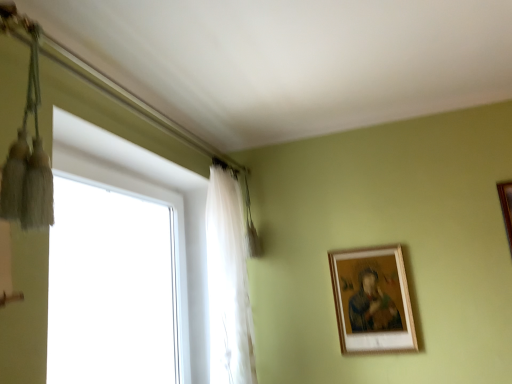
Image resolution: width=512 pixels, height=384 pixels. Describe the element at coordinates (156, 200) in the screenshot. I see `white glass window at left` at that location.

Where is `translucent white curtain at upper left`? This screenshot has height=384, width=512. translucent white curtain at upper left is located at coordinates (228, 283).

Is translucent white curtain at upper left inside the boundaries of wooden picture frame at upper right, the 2th picture frame viewed from the top, or outside?

translucent white curtain at upper left is outside wooden picture frame at upper right, the 2th picture frame viewed from the top.

Between point (238, 353) and point (356, 291), which one is positioned in front?

The point (238, 353) is in front.

At what (x,y) coordinates should I click in order to perform the action: click on picture frame below the translucent white curtain at upper left (from the image's perspective). Please return your answer as a coordinate pair (x, y). Image resolution: width=512 pixels, height=384 pixels. Looking at the image, I should click on (372, 300).

Consider the image. Is translucent white curtain at upper left bigger than wooden picture frame at upper right, the second picture frame in the right-to-left sequence?

Correct, translucent white curtain at upper left is larger in size than wooden picture frame at upper right, the second picture frame in the right-to-left sequence.

Looking at this image, from the image's perspective, is white glass window at left located beneath wooden picture frame at upper right, the second picture frame in the right-to-left sequence?

Actually, white glass window at left appears above wooden picture frame at upper right, the second picture frame in the right-to-left sequence, in the image.

Is white glass window at left oriented away from wooden picture frame at upper right, the second picture frame in the right-to-left sequence?

No, wooden picture frame at upper right, the second picture frame in the right-to-left sequence, is not at the back of white glass window at left.

Who is taller, white glass window at left or wooden picture frame at upper right, the first picture frame when ordered from left to right?

With more height is white glass window at left.

What's the angular difference between white glass window at left and wooden picture frame at upper right, the 2th picture frame viewed from the top,'s facing directions?

88.9 degrees.

Is point (507, 202) farther from camera compared to point (399, 266)?

No.

Are brown wooden picture frame at upper right, which is the 1th picture frame from top to bottom, and wooden picture frame at upper right, the first picture frame when ordered from left to right, making contact?

No, brown wooden picture frame at upper right, which is the 1th picture frame from top to bottom, is not next to wooden picture frame at upper right, the first picture frame when ordered from left to right.

Does brown wooden picture frame at upper right, the second picture frame positioned from the left, have a lesser width compared to wooden picture frame at upper right, the 2th picture frame viewed from the top?

Indeed, brown wooden picture frame at upper right, the second picture frame positioned from the left, has a lesser width compared to wooden picture frame at upper right, the 2th picture frame viewed from the top.

From the image's perspective, who appears lower, brown wooden picture frame at upper right, which is the 1th picture frame from top to bottom, or wooden picture frame at upper right, the second picture frame in the right-to-left sequence?

wooden picture frame at upper right, the second picture frame in the right-to-left sequence.

Would you say wooden picture frame at upper right, which appears as the first picture frame when ordered from the bottom, is inside or outside translucent white curtain at upper left?

wooden picture frame at upper right, which appears as the first picture frame when ordered from the bottom, is outside translucent white curtain at upper left.

Considering the positions of points (391, 326) and (218, 299), is point (391, 326) closer to camera compared to point (218, 299)?

No, it is not.

Is wooden picture frame at upper right, the first picture frame when ordered from left to right, not near translucent white curtain at upper left?

wooden picture frame at upper right, the first picture frame when ordered from left to right, is actually quite close to translucent white curtain at upper left.

Is translucent white curtain at upper left surrounded by brown wooden picture frame at upper right, the second picture frame when ordered from bottom to top?

No, translucent white curtain at upper left is not inside brown wooden picture frame at upper right, the second picture frame when ordered from bottom to top.

Consider the image. From the image's perspective, is brown wooden picture frame at upper right, which is the 1th picture frame from top to bottom, over translucent white curtain at upper left?

Yes.

Is brown wooden picture frame at upper right, which is counted as the first picture frame, starting from the right, next to translucent white curtain at upper left and touching it?

There is a gap between brown wooden picture frame at upper right, which is counted as the first picture frame, starting from the right, and translucent white curtain at upper left.

Does brown wooden picture frame at upper right, which is counted as the first picture frame, starting from the right, appear on the right side of translucent white curtain at upper left?

Yes.

Does white glass window at left come behind brown wooden picture frame at upper right, the second picture frame when ordered from bottom to top?

No, white glass window at left is closer to the camera.

Considering the positions of point (183, 285) and point (510, 195), is point (183, 285) closer or farther from the camera than point (510, 195)?

Point (183, 285) is farther from the camera than point (510, 195).

Is white glass window at left looking in the opposite direction of brown wooden picture frame at upper right, which is the 1th picture frame from top to bottom?

No, white glass window at left is not facing the opposite direction of brown wooden picture frame at upper right, which is the 1th picture frame from top to bottom.

Are white glass window at left and brown wooden picture frame at upper right, the second picture frame positioned from the left, far apart?

Yes.

Which is in front, point (510, 207) or point (102, 181)?

The point (102, 181) is closer to the camera.

Is brown wooden picture frame at upper right, the second picture frame positioned from the left, beside white glass window at left?

They are not placed beside each other.

From a real-world perspective, who is located higher, brown wooden picture frame at upper right, the second picture frame when ordered from bottom to top, or white glass window at left?

brown wooden picture frame at upper right, the second picture frame when ordered from bottom to top, is physically above.

Is brown wooden picture frame at upper right, the second picture frame when ordered from bottom to top, looking in the opposite direction of white glass window at left?

No, white glass window at left is not at the back of brown wooden picture frame at upper right, the second picture frame when ordered from bottom to top.

Where is `curtain in front of the wooden picture frame at upper right, the first picture frame when ordered from left to right`? The image size is (512, 384). curtain in front of the wooden picture frame at upper right, the first picture frame when ordered from left to right is located at coordinates (228, 283).

Identify the location of window lying above the wooden picture frame at upper right, the first picture frame when ordered from left to right (from the image's perspective). [x=156, y=200].

From the image, which object appears to be nearer to translucent white curtain at upper left, brown wooden picture frame at upper right, which is the 1th picture frame from top to bottom, or white glass window at left?

Among the two, white glass window at left is located nearer to translucent white curtain at upper left.

From the image, which object appears to be nearer to white glass window at left, translucent white curtain at upper left or brown wooden picture frame at upper right, the second picture frame when ordered from bottom to top?

The object closer to white glass window at left is translucent white curtain at upper left.

Looking at the image, which one is located further to wooden picture frame at upper right, the second picture frame in the right-to-left sequence, brown wooden picture frame at upper right, which is the 1th picture frame from top to bottom, or translucent white curtain at upper left?

Based on the image, brown wooden picture frame at upper right, which is the 1th picture frame from top to bottom, appears to be further to wooden picture frame at upper right, the second picture frame in the right-to-left sequence.

When comparing their distances from wooden picture frame at upper right, the first picture frame when ordered from left to right, does translucent white curtain at upper left or brown wooden picture frame at upper right, the second picture frame when ordered from bottom to top, seem further?

brown wooden picture frame at upper right, the second picture frame when ordered from bottom to top, is further to wooden picture frame at upper right, the first picture frame when ordered from left to right.

From the image, which object appears to be nearer to white glass window at left, wooden picture frame at upper right, the 2th picture frame viewed from the top, or translucent white curtain at upper left?

translucent white curtain at upper left is positioned closer to the anchor white glass window at left.

From the image, which object appears to be nearer to wooden picture frame at upper right, which appears as the first picture frame when ordered from the bottom, white glass window at left or brown wooden picture frame at upper right, the second picture frame positioned from the left?

Based on the image, brown wooden picture frame at upper right, the second picture frame positioned from the left, appears to be nearer to wooden picture frame at upper right, which appears as the first picture frame when ordered from the bottom.

Based on their spatial positions, is brown wooden picture frame at upper right, which is the 1th picture frame from top to bottom, or wooden picture frame at upper right, the first picture frame when ordered from left to right, closer to translucent white curtain at upper left?

wooden picture frame at upper right, the first picture frame when ordered from left to right, is closer to translucent white curtain at upper left.

From the image, which object appears to be nearer to white glass window at left, brown wooden picture frame at upper right, which is the 1th picture frame from top to bottom, or translucent white curtain at upper left?

translucent white curtain at upper left lies closer to white glass window at left than the other object.

You are a GUI agent. You are given a task and a screenshot of the screen. Output one action in this format:
    pyautogui.click(x=<x>, y=<y>)
    Task: Click on the picture frame between translucent white curtain at upper left and brown wooden picture frame at upper right, the second picture frame when ordered from bottom to top, in the horizontal direction
    
    Given the screenshot: What is the action you would take?
    pyautogui.click(x=372, y=300)

This screenshot has width=512, height=384. I want to click on curtain situated between white glass window at left and wooden picture frame at upper right, the first picture frame when ordered from left to right, from left to right, so click(x=228, y=283).

Locate an element on the screen. picture frame between white glass window at left and brown wooden picture frame at upper right, which is the 1th picture frame from top to bottom, from left to right is located at coordinates (372, 300).

The height and width of the screenshot is (384, 512). I want to click on curtain situated between white glass window at left and brown wooden picture frame at upper right, the second picture frame when ordered from bottom to top, from left to right, so click(228, 283).